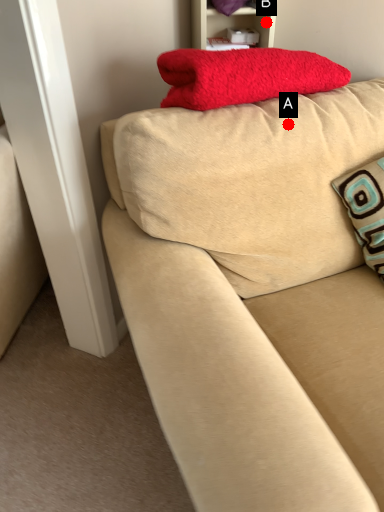
Question: Two points are circled on the image, labeled by A and B beside each circle. Among these points, which one is farthest from the camera?

Choices:
 (A) A is further
 (B) B is further

Answer: (B)